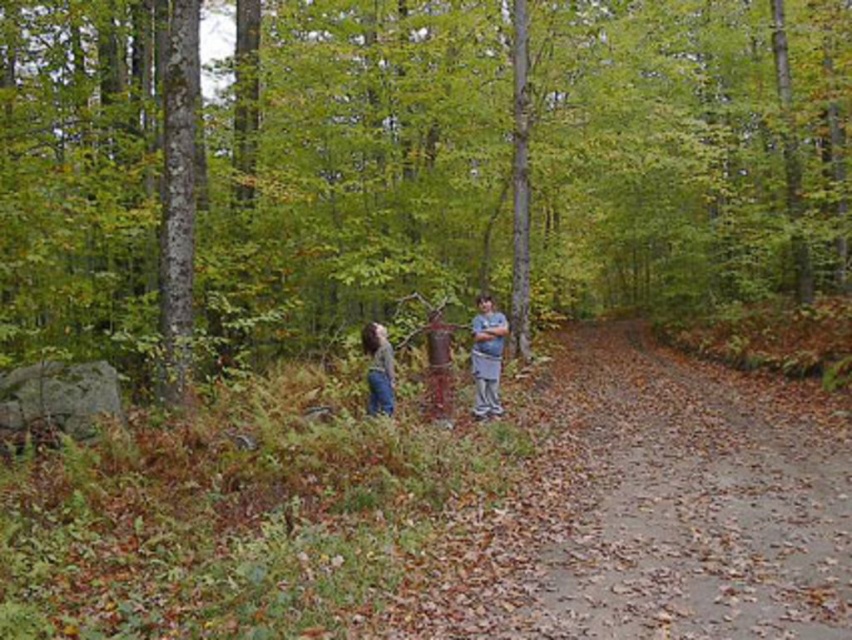
You are standing at the red fire hydrant and want to walk directly towards the green matte tree at center. According to the coordinates provided, in which direction should you head?

The green matte tree at center is located at coordinates point (x=422, y=173). Since you are at the red fire hydrant, you should walk towards the direction of the coordinates to reach the green matte tree at center.

You are a hiker trying to locate your friend who is wearing denim jeans at center. You see the green matte tree at center in the forest. Which direction should you move to find your friend?

The denim jeans at center is behind the green matte tree at center, so you should move behind the green matte tree at center to find your friend.

You are walking on the dirt path in the forest and see the green matte tree at center and the gray cotton shirt at center. Which object is closer to you?

The green matte tree at center is closer to the viewer than the gray cotton shirt at center.